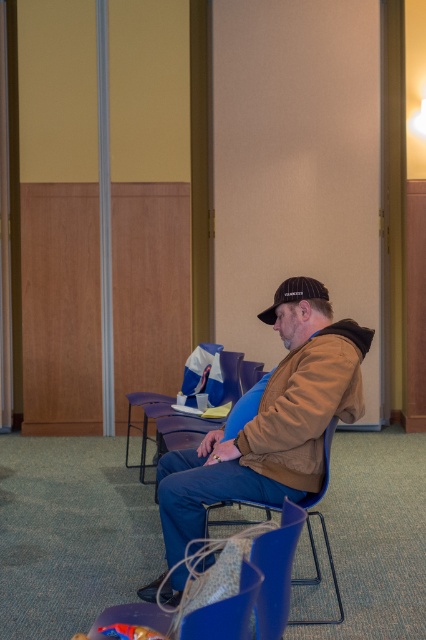
From the picture: Between blue plastic chair at center and black matte baseball cap at center, which one has more height?

blue plastic chair at center

Locate an element on the screen. The height and width of the screenshot is (640, 426). blue plastic chair at center is located at coordinates (322, 529).

Does brown suede jacket at center appear under blue plastic chair at center?

No.

Who is taller, brown suede jacket at center or blue plastic chair at center?

brown suede jacket at center

You are a GUI agent. You are given a task and a screenshot of the screen. Output one action in this format:
    pyautogui.click(x=<x>, y=<y>)
    Task: Click on the brown suede jacket at center
    
    Given the screenshot: What is the action you would take?
    270,426

You are a GUI agent. You are given a task and a screenshot of the screen. Output one action in this format:
    pyautogui.click(x=<x>, y=<y>)
    Task: Click on the brown suede jacket at center
    
    Given the screenshot: What is the action you would take?
    pyautogui.click(x=270, y=426)

Can you confirm if brown suede jacket at center is bigger than black matte baseball cap at center?

Indeed, brown suede jacket at center has a larger size compared to black matte baseball cap at center.

This screenshot has width=426, height=640. I want to click on brown suede jacket at center, so click(x=270, y=426).

What do you see at coordinates (270, 426) in the screenshot? The image size is (426, 640). I see `brown suede jacket at center` at bounding box center [270, 426].

The width and height of the screenshot is (426, 640). In order to click on brown suede jacket at center in this screenshot , I will do `click(270, 426)`.